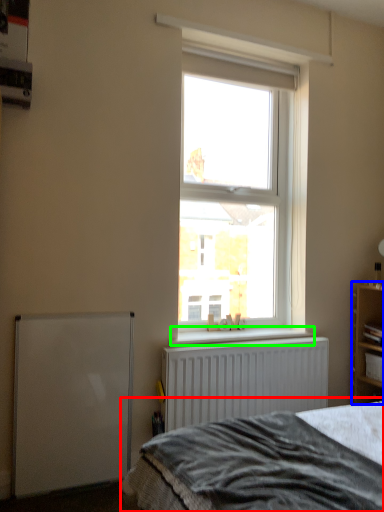
Question: Based on their relative distances, which object is farther from bed (highlighted by a red box)? Choose from shelf (highlighted by a blue box) and window sill (highlighted by a green box).

Choices:
 (A) shelf
 (B) window sill

Answer: (A)